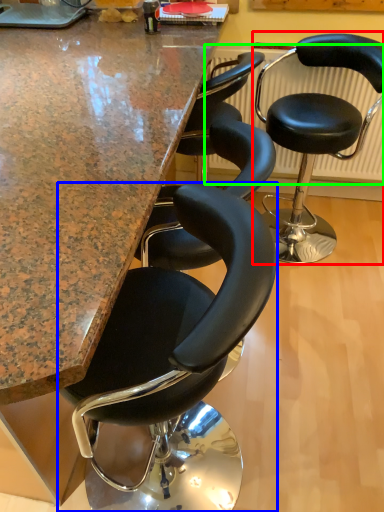
Question: Which object is positioned farthest from chair (highlighted by a red box)? Select from chair (highlighted by a blue box) and radiator (highlighted by a green box).

Choices:
 (A) chair
 (B) radiator

Answer: (A)